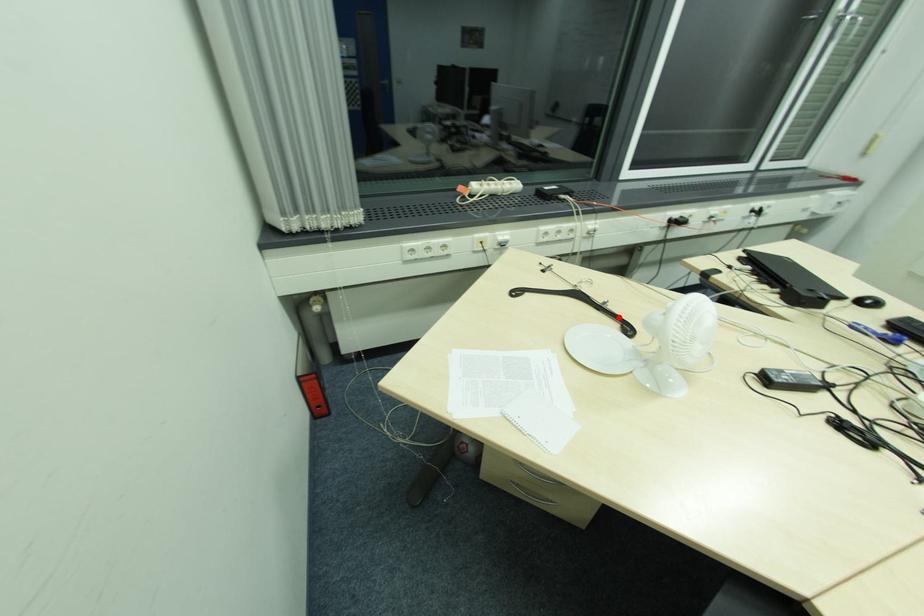
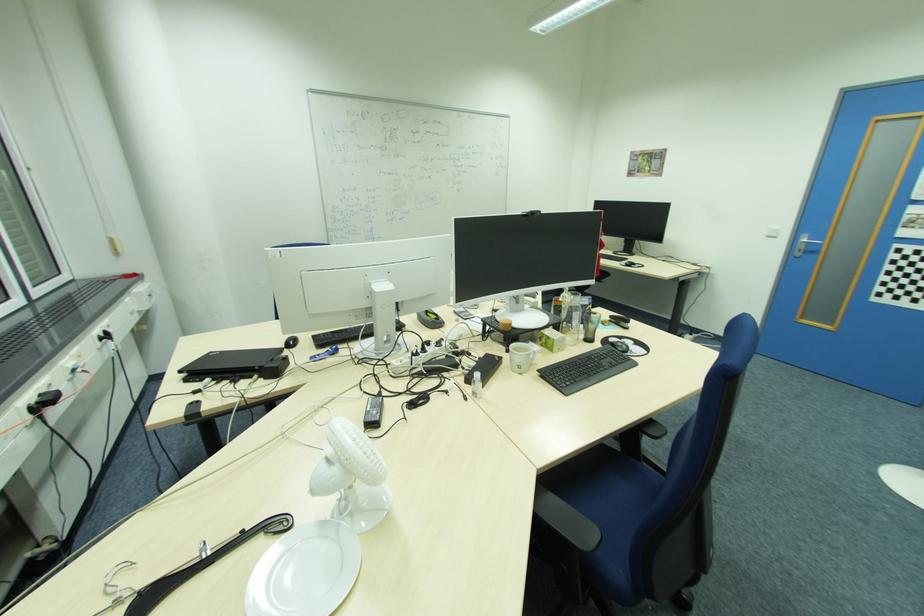
The point at the highlighted location is marked in the first image. Where is the corresponding point in the second image?

(246, 538)